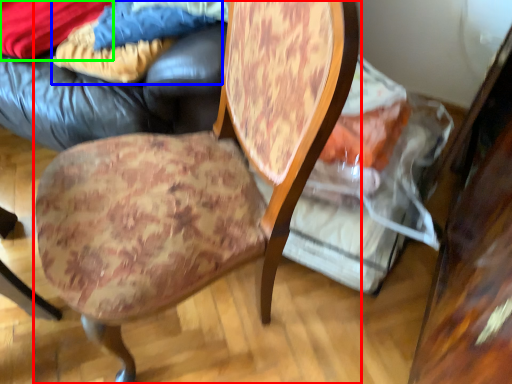
Question: Which is farther away from chair (highlighted by a red box)? fabric (highlighted by a blue box) or fabric (highlighted by a green box)?

Choices:
 (A) fabric
 (B) fabric

Answer: (B)